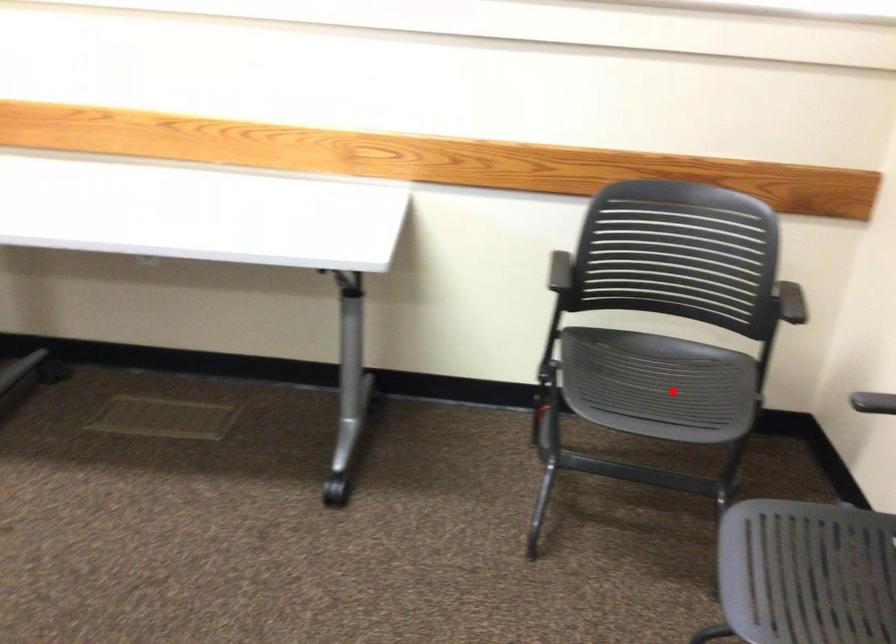
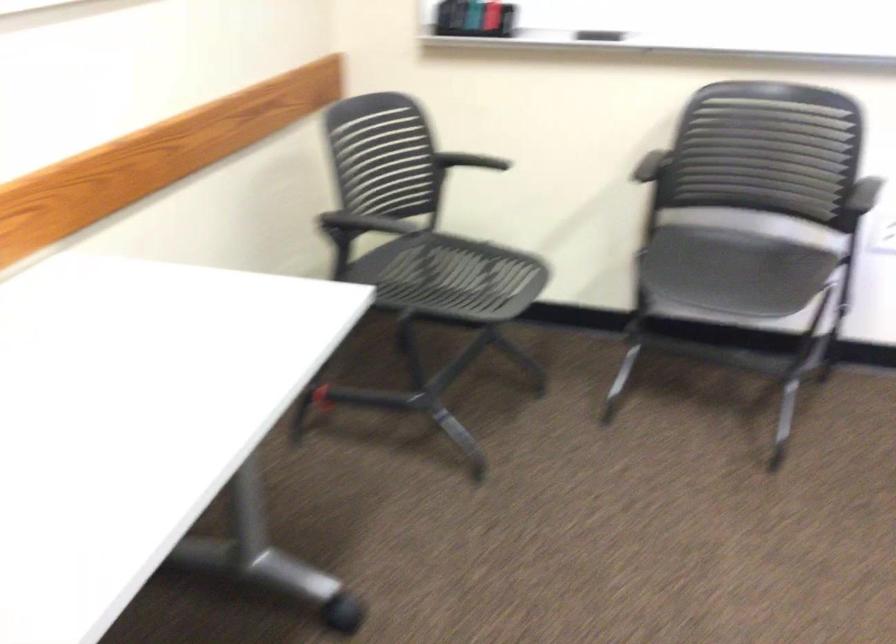
Question: I am providing you with two images of the same scene from different viewpoints. In image1, a red point is highlighted. Considering the same 3D point in image2, which of the following is correct?

Choices:
 (A) It is closer
 (B) It is farther

Answer: (B)